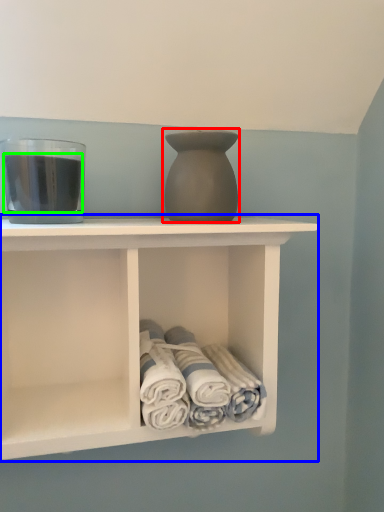
Question: Estimate the real-world distances between objects in this image. Which object is closer to vase (highlighted by a red box), shelf (highlighted by a blue box) or beverage (highlighted by a green box)?

Choices:
 (A) shelf
 (B) beverage

Answer: (B)